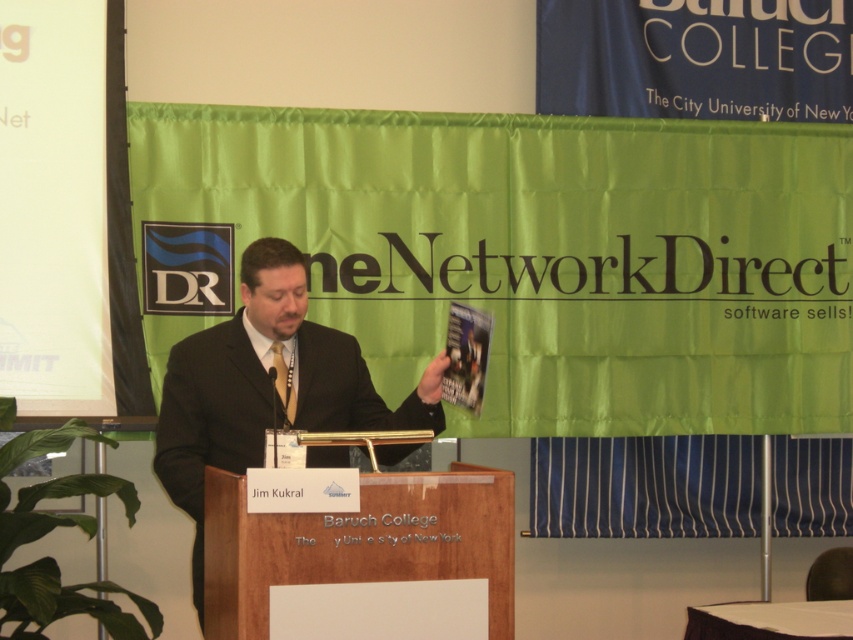
Question: Does black suit at center have a greater width compared to wooden podium at center?

Choices:
 (A) no
 (B) yes

Answer: (A)

Question: Estimate the real-world distances between objects in this image. Which object is farther from the wooden podium at center?

Choices:
 (A) black suit at center
 (B) silky gold tie at center

Answer: (B)

Question: Which of the following is the closest to the observer?

Choices:
 (A) black suit at center
 (B) silky gold tie at center

Answer: (A)

Question: Which object appears farthest from the camera in this image?

Choices:
 (A) wooden podium at center
 (B) black suit at center
 (C) silky gold tie at center

Answer: (C)

Question: Is black suit at center in front of silky gold tie at center?

Choices:
 (A) no
 (B) yes

Answer: (B)

Question: Can you confirm if black suit at center is positioned to the right of wooden podium at center?

Choices:
 (A) yes
 (B) no

Answer: (B)